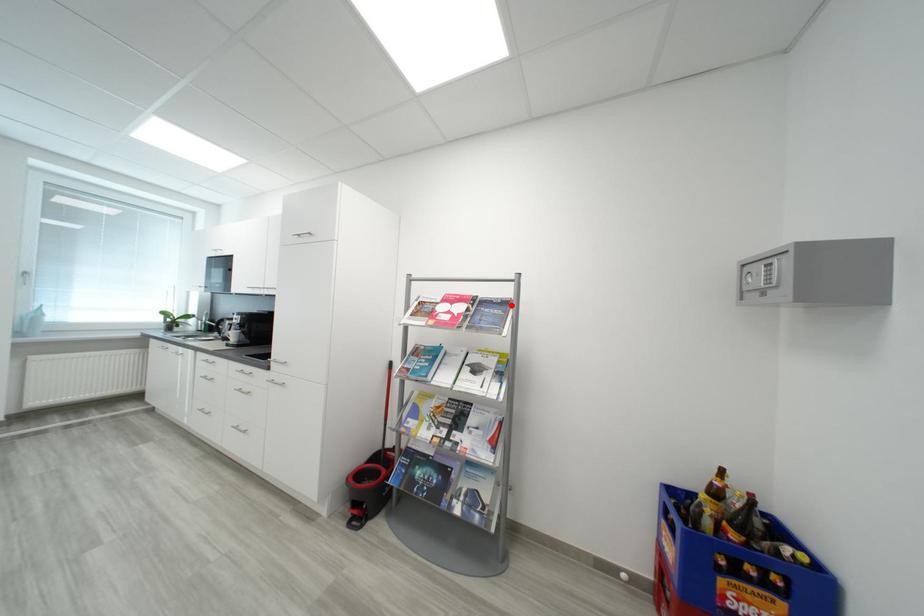
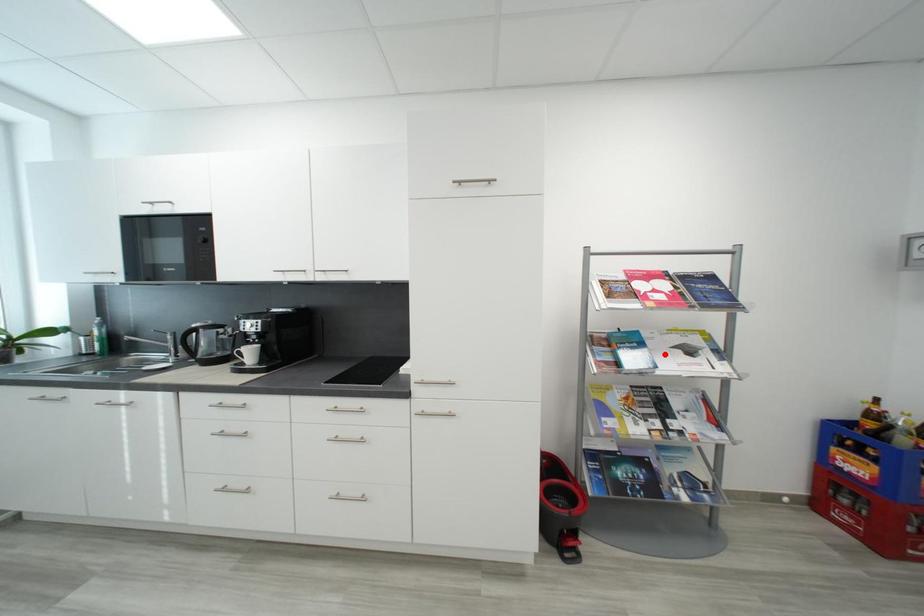
I am providing you with two images of the same scene from different viewpoints. A red point is marked on the first image and another point is marked on the second image. Do the highlighted points in image1 and image2 indicate the same real-world spot?

No